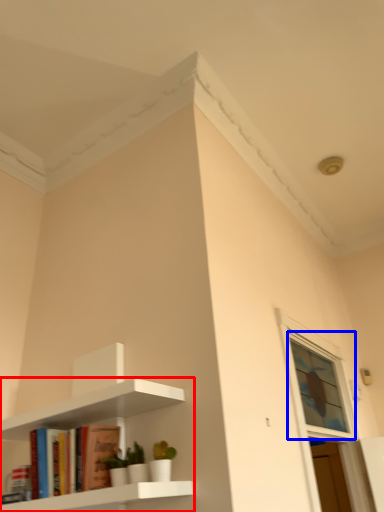
Question: Which of the following is the farthest to the observer, shelf (highlighted by a red box) or window (highlighted by a blue box)?

Choices:
 (A) shelf
 (B) window

Answer: (B)